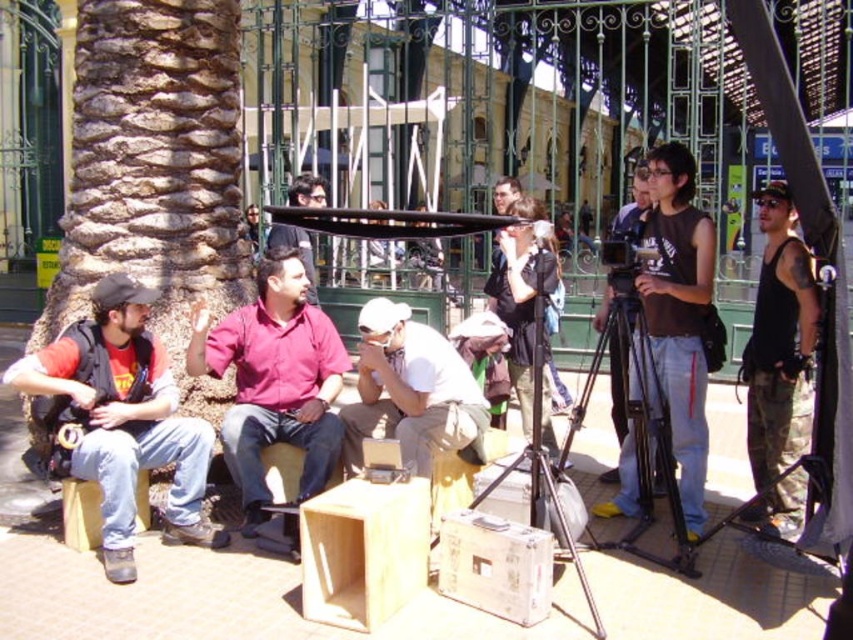
Question: Is black matte camera at center bigger than metallic silver tripod at center?

Choices:
 (A) yes
 (B) no

Answer: (A)

Question: Is matte black backpack at left bigger than white matte shirt at center?

Choices:
 (A) no
 (B) yes

Answer: (A)

Question: Estimate the real-world distances between objects in this image. Which object is farther from the matte red shirt at center?

Choices:
 (A) black matte camera at center
 (B) black metal tripod at center

Answer: (A)

Question: In this image, where is matte black camera at center located relative to matte pink shirt at center?

Choices:
 (A) above
 (B) below

Answer: (B)

Question: Which object is the closest to the metallic silver tripod at center?

Choices:
 (A) matte red shirt at center
 (B) black tank top at right

Answer: (B)

Question: Which point appears farthest from the camera in this image?

Choices:
 (A) (363, 419)
 (B) (647, 195)
 (C) (242, 349)

Answer: (B)